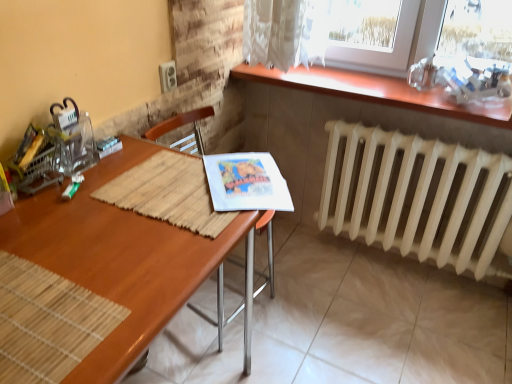
Image resolution: width=512 pixels, height=384 pixels. I want to click on free location above wooden desk at center (from a real-world perspective), so click(x=109, y=225).